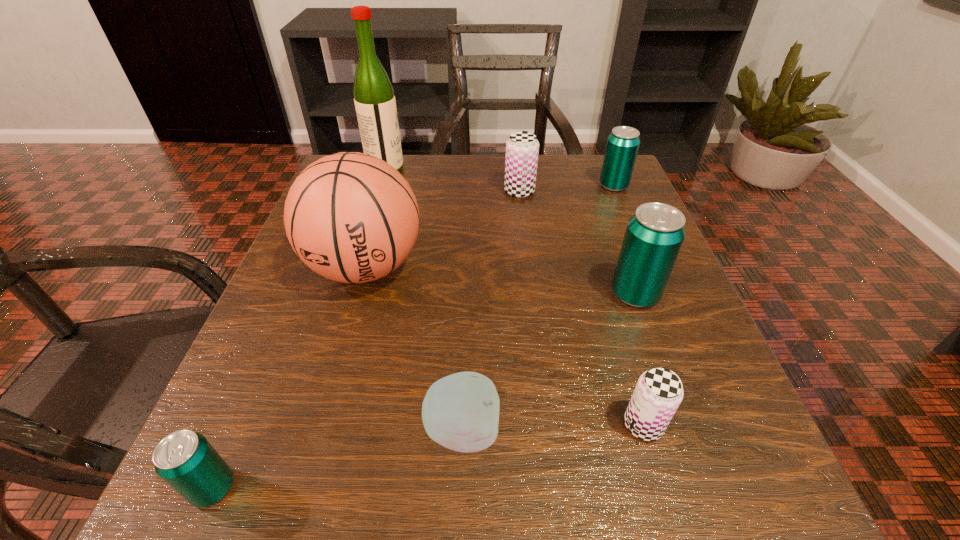
Image resolution: width=960 pixels, height=540 pixels. Find the location of `apple`. apple is located at coordinates (460, 412).

Identify the location of the nearer purple beer can. This screenshot has width=960, height=540. coord(658,393).

Where is `the smaller purple beer can`? Image resolution: width=960 pixels, height=540 pixels. the smaller purple beer can is located at coordinates (658, 393).

Find the location of a particular element. The height and width of the screenshot is (540, 960). the leftmost beer can is located at coordinates (185, 460).

At what (x,y) coordinates should I click in order to perform the action: click on the nearest beer can. Please return your answer as a coordinate pair (x, y). The width and height of the screenshot is (960, 540). Looking at the image, I should click on (185, 460).

The width and height of the screenshot is (960, 540). I want to click on vacant space located 0.120m on the label of the liquor, so click(453, 169).

This screenshot has height=540, width=960. Find the location of `free location located 0.250m on the surface of the orange basketball near the brand logo`. free location located 0.250m on the surface of the orange basketball near the brand logo is located at coordinates (311, 457).

The image size is (960, 540). What are the coordinates of `vacant space located 0.100m on the back of the third nearest beer can` in the screenshot? It's located at [616, 242].

The image size is (960, 540). I want to click on vacant area situated on the left of the fourth beer can from right to left, so click(x=403, y=191).

The image size is (960, 540). I want to click on free space located 0.390m on the left of the farthest teal beer can, so click(x=430, y=186).